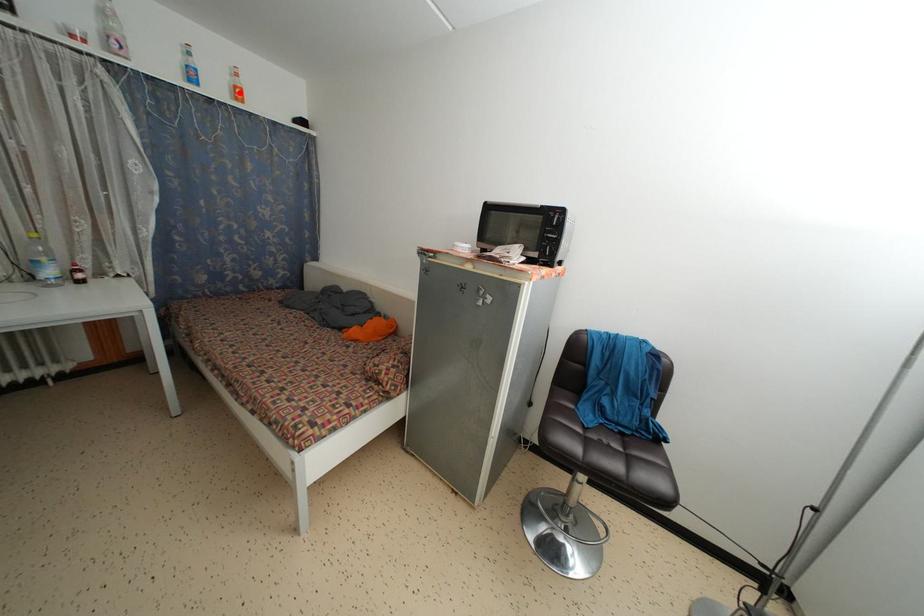
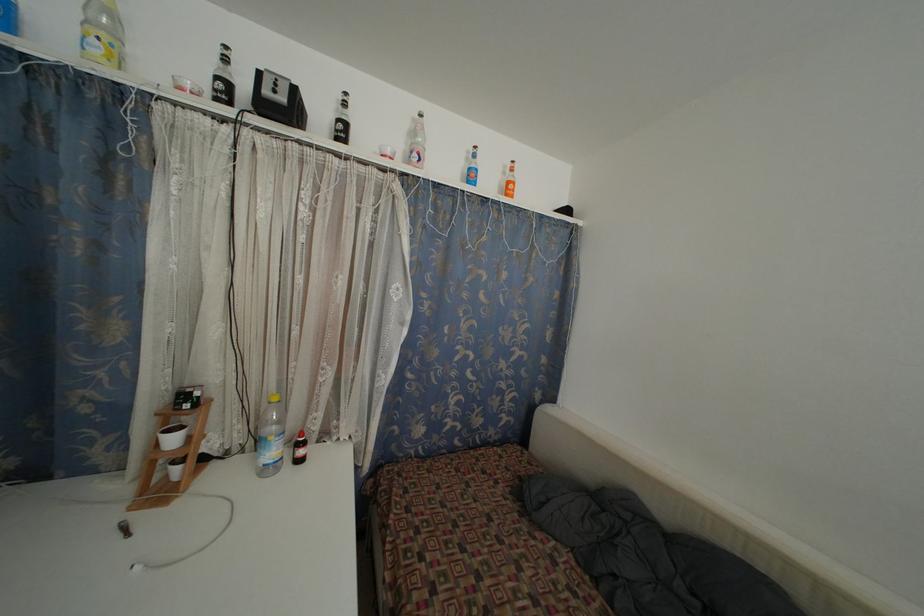
The point at the highlighted location is marked in the first image. Where is the corresponding point in the second image?

(513, 188)